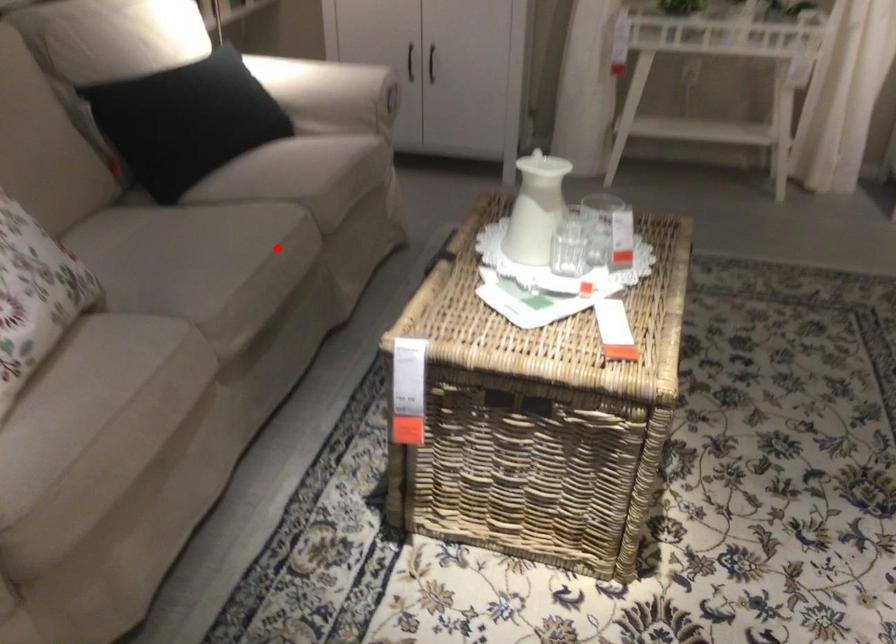
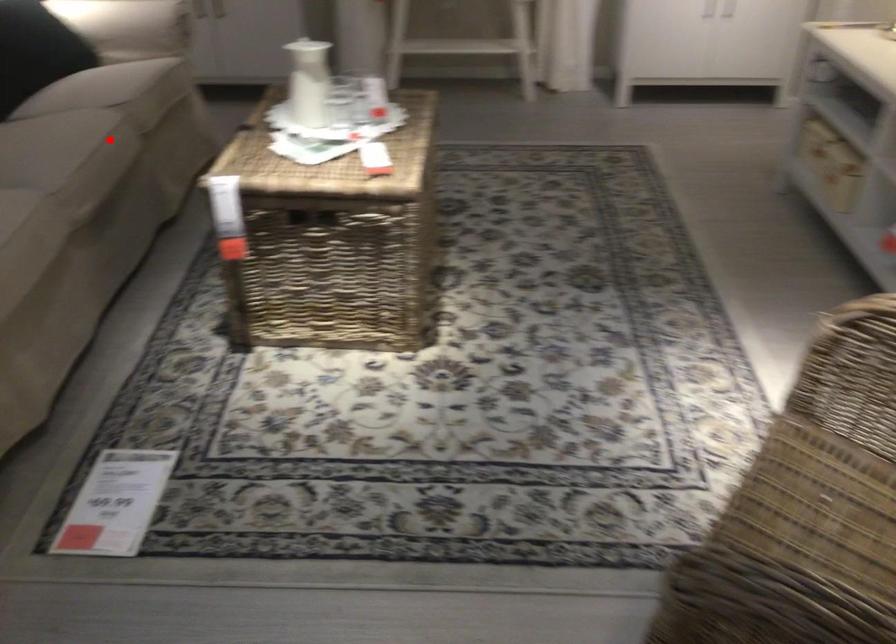
I am providing you with two images of the same scene from different viewpoints. A red point is marked on the first image and another point is marked on the second image. Is the marked point in image1 the same physical position as the marked point in image2?

Yes